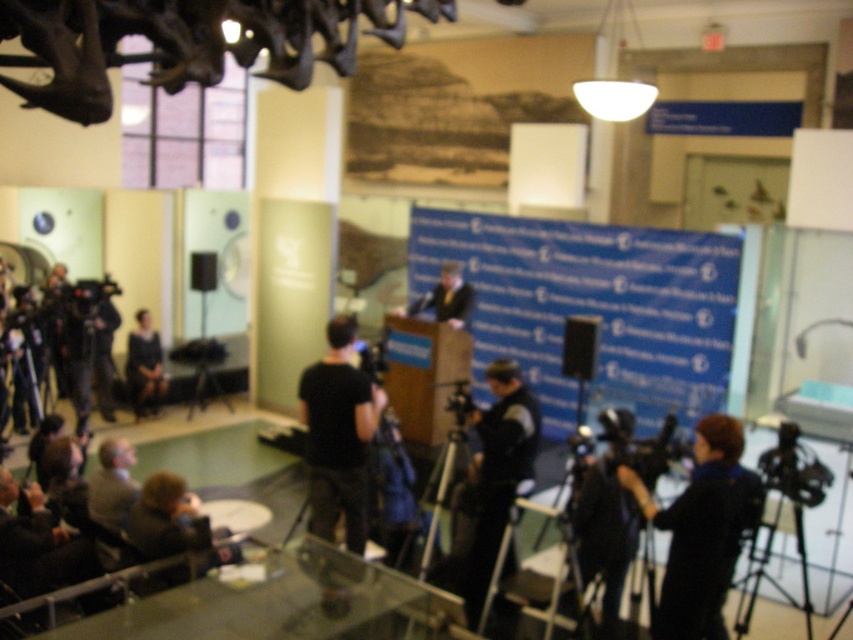
Question: Which point is closer to the camera?

Choices:
 (A) black cotton shirt at center
 (B) dark gray jacket at center

Answer: (B)

Question: Is dark blue coat at lower right thinner than dark gray jacket at center?

Choices:
 (A) no
 (B) yes

Answer: (A)

Question: Among these objects, which one is nearest to the camera?

Choices:
 (A) black cotton shirt at center
 (B) dark fabric dress at center
 (C) dark gray jacket at center

Answer: (C)

Question: Which point appears closest to the camera in this image?

Choices:
 (A) (671, 604)
 (B) (360, 444)
 (C) (155, 385)

Answer: (A)

Question: Can you confirm if dark blue coat at lower right is thinner than dark gray jacket at center?

Choices:
 (A) yes
 (B) no

Answer: (B)

Question: Is dark blue coat at lower right behind dark gray jacket at center?

Choices:
 (A) no
 (B) yes

Answer: (A)